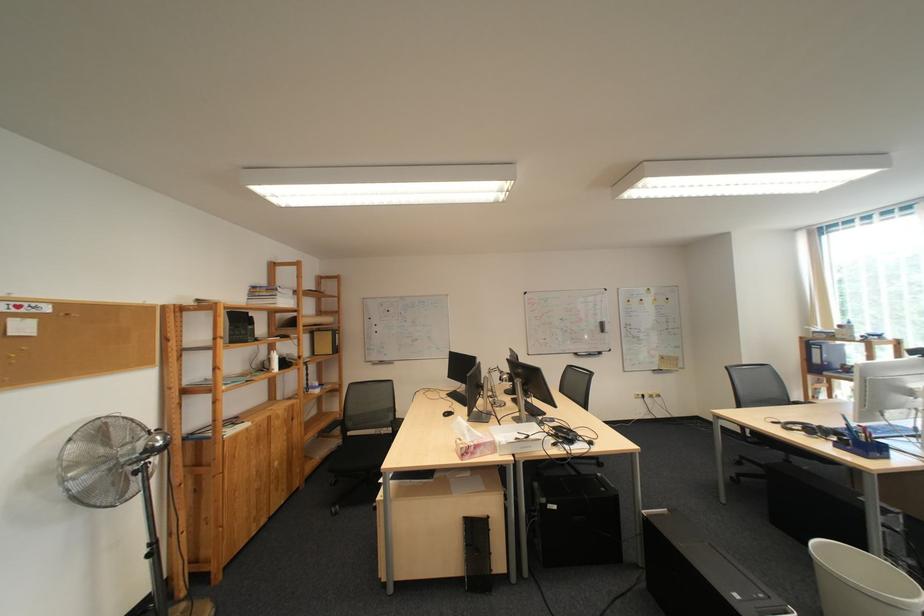
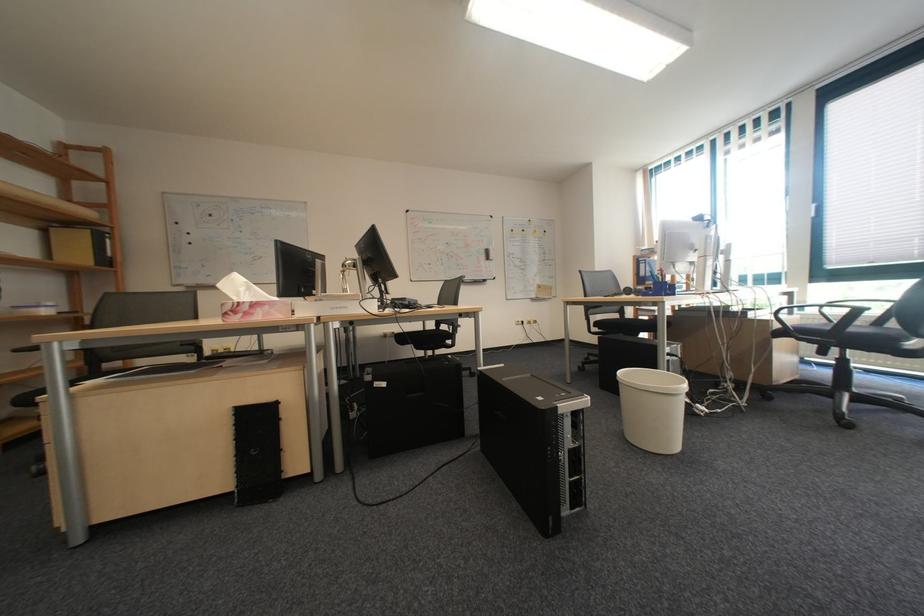
Which direction would the cameraman need to move to produce the second image?

The cameraman walked toward right, forward.